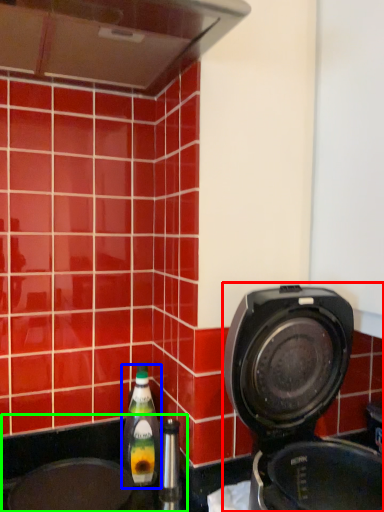
Question: Which object is the farthest from home appliance (highlighted by a red box)? Choose among these: bottle (highlighted by a blue box) or sink (highlighted by a green box).

Choices:
 (A) bottle
 (B) sink

Answer: (A)